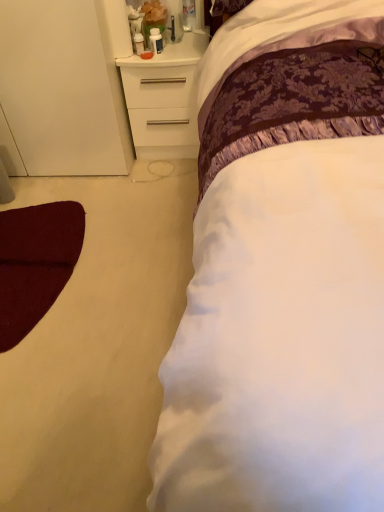
Question: In the image, is white matte chest of drawers at upper left on the left side or the right side of white satin bed at center?

Choices:
 (A) left
 (B) right

Answer: (A)

Question: In terms of width, does white matte chest of drawers at upper left look wider or thinner when compared to white satin bed at center?

Choices:
 (A) wide
 (B) thin

Answer: (B)

Question: Is white matte chest of drawers at upper left bigger or smaller than white satin bed at center?

Choices:
 (A) big
 (B) small

Answer: (B)

Question: Considering the positions of white satin bed at center and white matte chest of drawers at upper left in the image, is white satin bed at center wider or thinner than white matte chest of drawers at upper left?

Choices:
 (A) thin
 (B) wide

Answer: (B)

Question: Does point (274, 334) appear closer or farther from the camera than point (150, 106)?

Choices:
 (A) closer
 (B) farther

Answer: (A)

Question: In terms of height, does white satin bed at center look taller or shorter compared to white matte chest of drawers at upper left?

Choices:
 (A) short
 (B) tall

Answer: (B)

Question: Considering the positions of white satin bed at center and white matte chest of drawers at upper left in the image, is white satin bed at center bigger or smaller than white matte chest of drawers at upper left?

Choices:
 (A) small
 (B) big

Answer: (B)